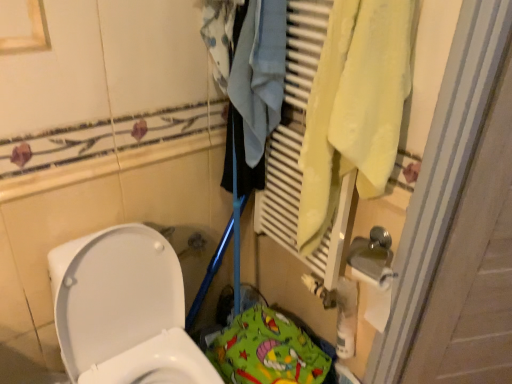
Question: From the image's perspective, is white glossy toilet at lower left positioned above or below green fabric play mat at lower center?

Choices:
 (A) below
 (B) above

Answer: (B)

Question: Would you say white glossy toilet at lower left is inside or outside green fabric play mat at lower center?

Choices:
 (A) inside
 (B) outside

Answer: (B)

Question: Based on their relative distances, which object is nearer to the green fabric play mat at lower center?

Choices:
 (A) yellow fabric towel at right
 (B) white glossy toilet at lower left

Answer: (B)

Question: Considering the real-world distances, which object is closest to the yellow fabric towel at right?

Choices:
 (A) green fabric play mat at lower center
 (B) white glossy toilet at lower left

Answer: (B)